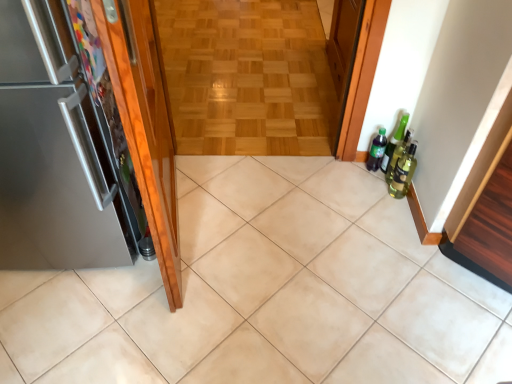
At what (x,y) coordinates should I click in order to perform the action: click on vacant space to the right of shiny wood door at left, arranged as the first door when viewed from the right. Please return your answer as a coordinate pair (x, y). Looking at the image, I should click on (282, 231).